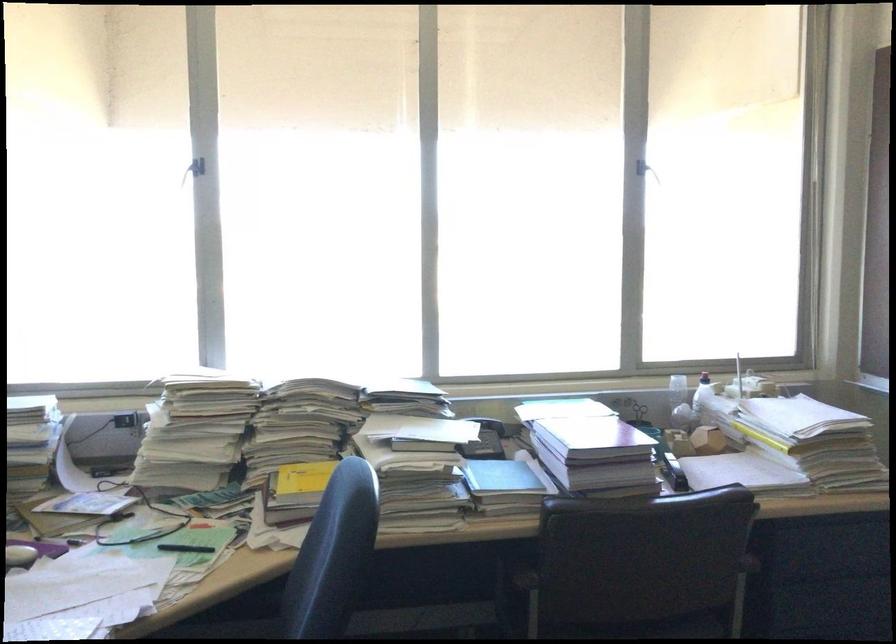
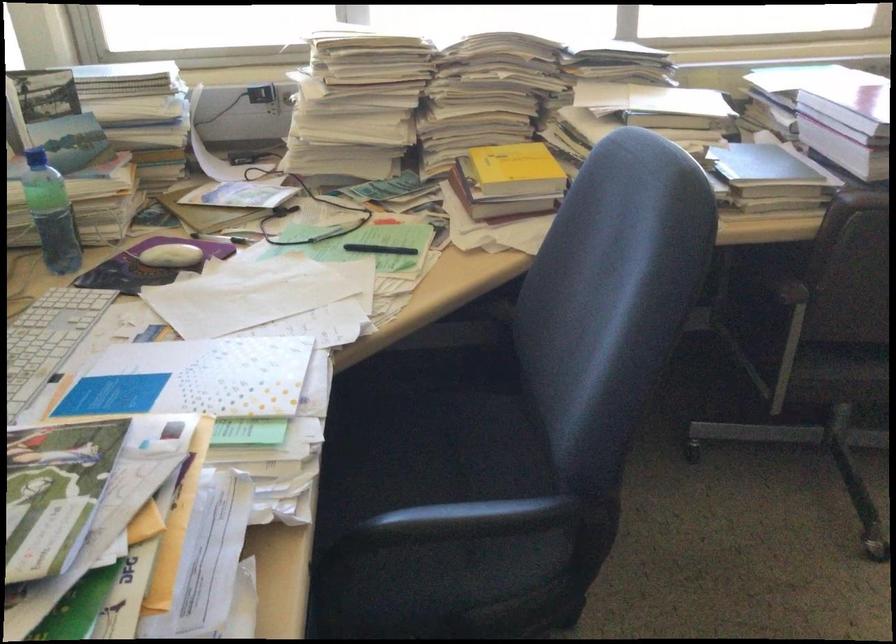
Question: The first image is from the beginning of the video and the second image is from the end. How did the camera likely rotate when shooting the video?

Choices:
 (A) Left
 (B) Right
 (C) Up
 (D) Down

Answer: (D)